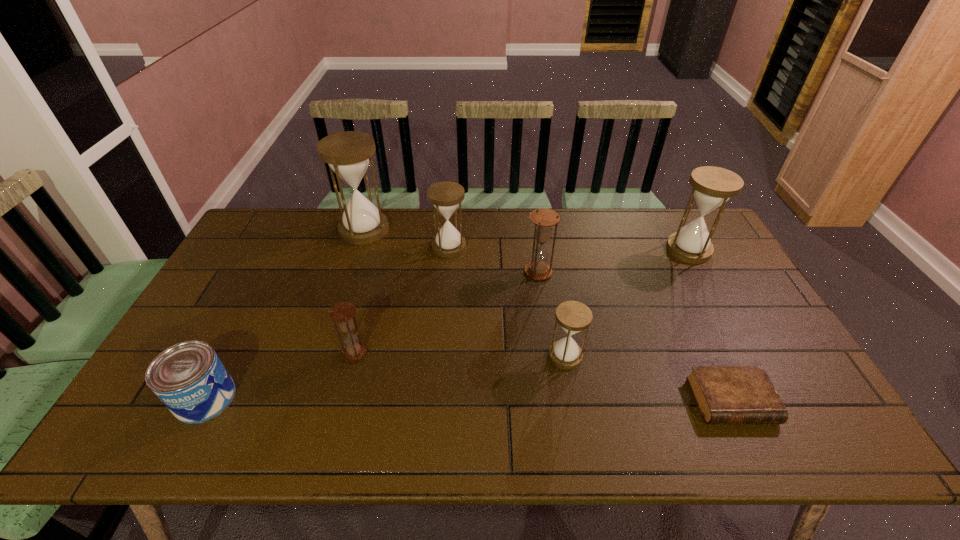
Where is `the biggest white hourglass`? Image resolution: width=960 pixels, height=540 pixels. the biggest white hourglass is located at coordinates (348, 154).

This screenshot has width=960, height=540. In order to click on the leftmost white hourglass in this screenshot , I will do `click(348, 154)`.

Locate an element on the screen. The height and width of the screenshot is (540, 960). the rightmost white hourglass is located at coordinates (712, 186).

Locate an element on the screen. The image size is (960, 540). the fifth shortest hourglass is located at coordinates (712, 186).

Image resolution: width=960 pixels, height=540 pixels. What are the coordinates of `the right brown hourglass` in the screenshot? It's located at (544, 219).

Locate an element on the screen. This screenshot has width=960, height=540. the bigger brown hourglass is located at coordinates (544, 219).

Image resolution: width=960 pixels, height=540 pixels. I want to click on the second smallest white hourglass, so click(x=446, y=196).

The image size is (960, 540). Find the location of `the third white hourglass from right to left`. the third white hourglass from right to left is located at coordinates (446, 196).

Find the location of a particular element. the third white hourglass from left to right is located at coordinates click(x=573, y=316).

Where is `the nearest white hourglass`? The width and height of the screenshot is (960, 540). the nearest white hourglass is located at coordinates (573, 316).